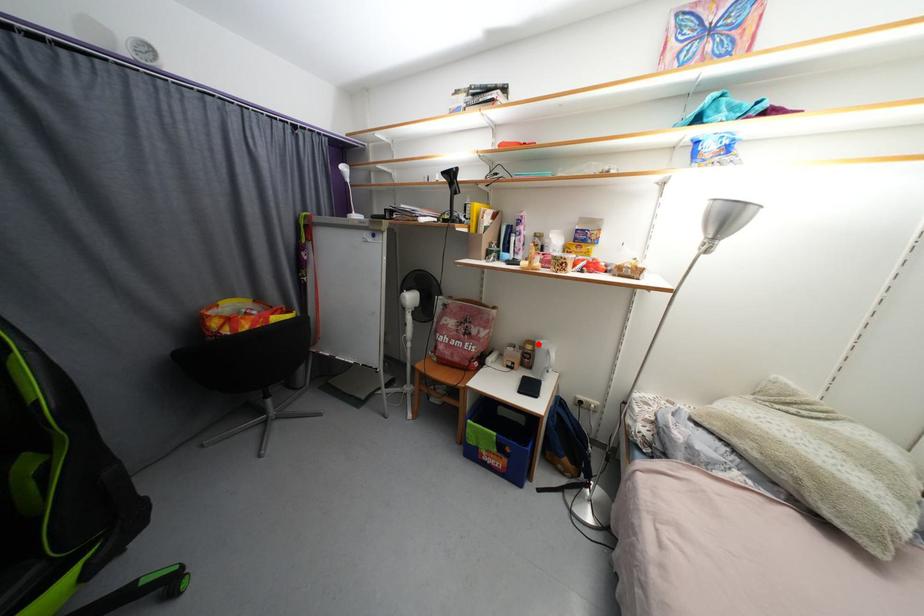
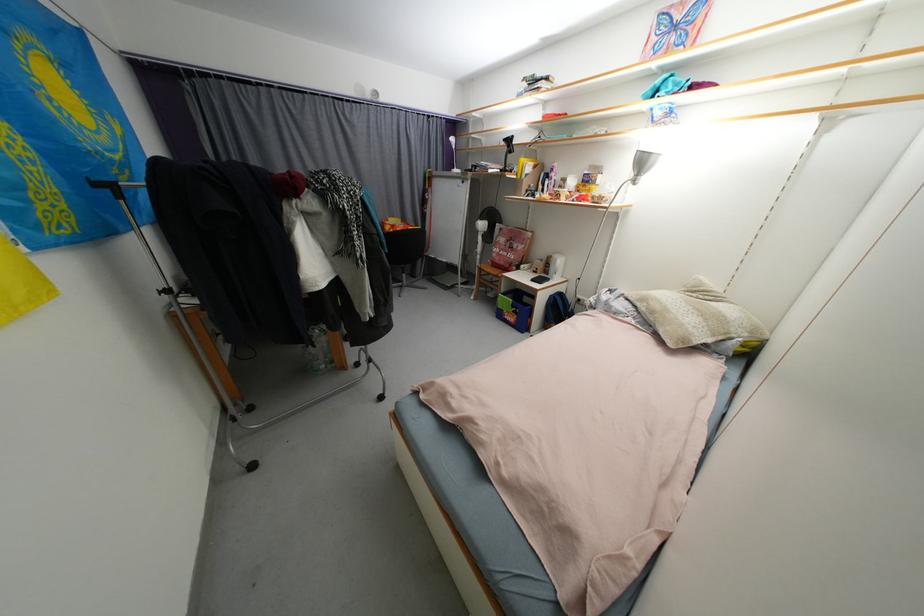
Question: I am providing you with two images of the same scene from different viewpoints. A red point is shown in image1. For the corresponding object point in image2, is it positioned nearer or farther from the camera?

Choices:
 (A) Nearer
 (B) Farther

Answer: (A)